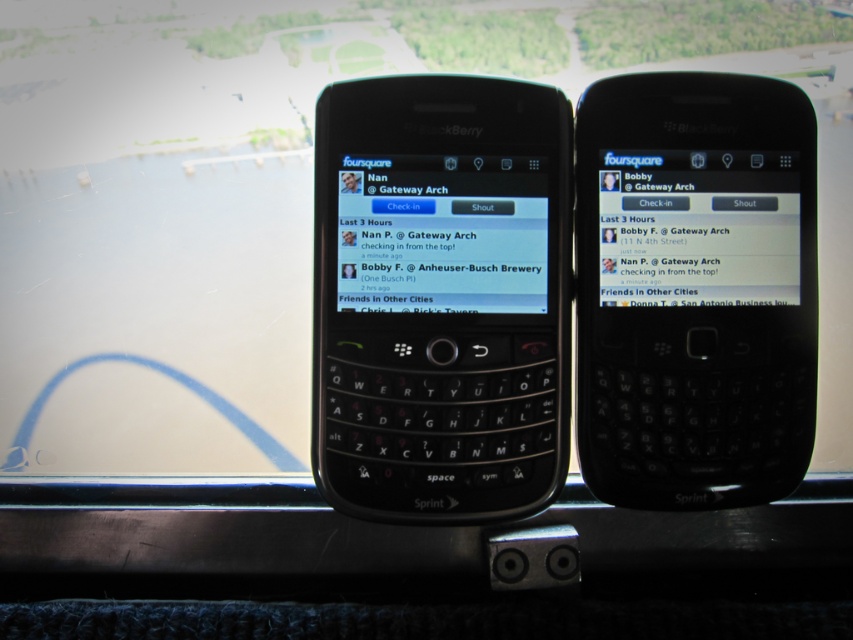
You are holding a magnifying glass to examine the two points on the left phone. Which point is closer to your eye? The points are labeled as point at coordinate (461,124) and point at coordinate (436,188).

Point at coordinate (436,188) is closer to your eye because it is less further away than point at coordinate (461,124).